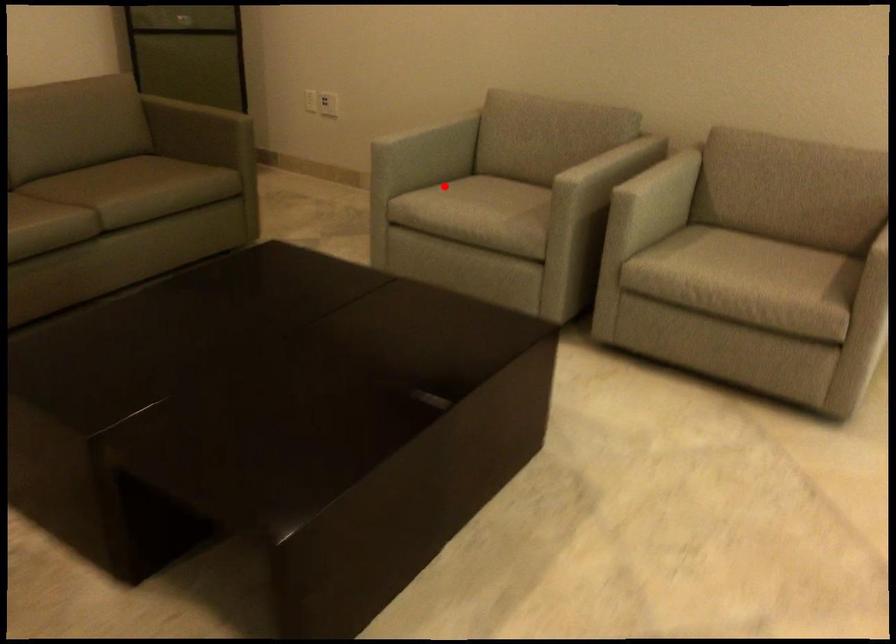
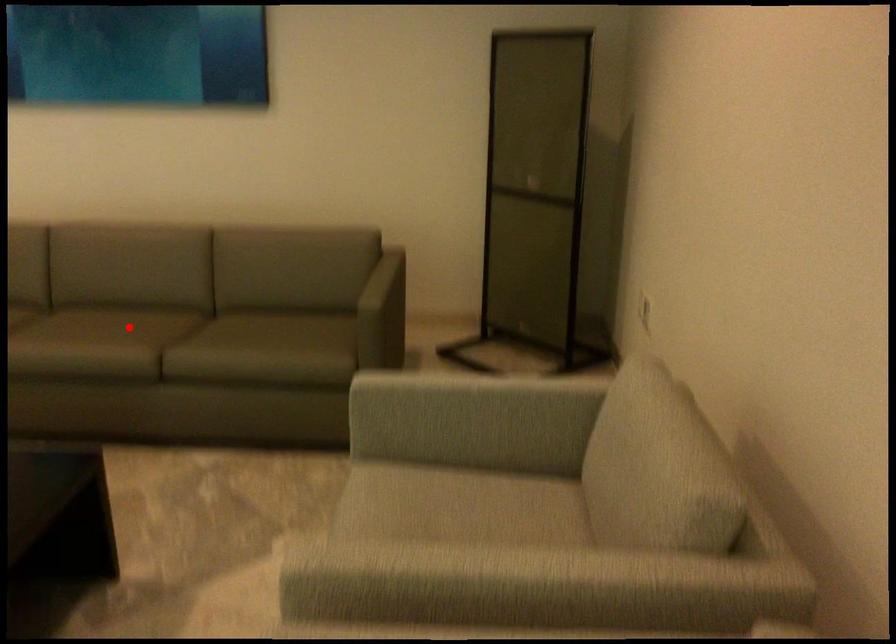
I am providing you with two images of the same scene from different viewpoints. A red point is marked on the first image and another point is marked on the second image. Are the points marked in image1 and image2 representing the same 3D position?

No